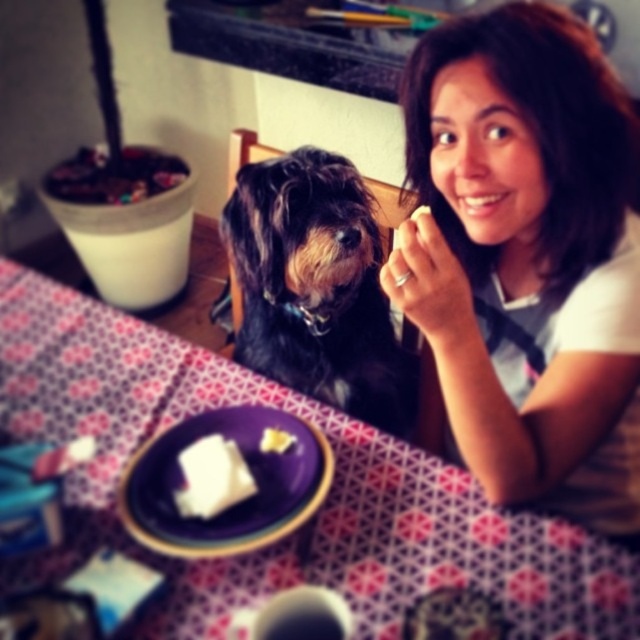
Question: Which of the following is the closest to the observer?

Choices:
 (A) patterned fabric tablecloth at center
 (B) purple matte plate at center

Answer: (A)

Question: Does white cotton shirt at upper right appear on the right side of purple matte plate at center?

Choices:
 (A) no
 (B) yes

Answer: (B)

Question: From the image, what is the correct spatial relationship of patterned fabric tablecloth at center in relation to white soft cheese at center?

Choices:
 (A) right
 (B) left

Answer: (B)

Question: Estimate the real-world distances between objects in this image. Which object is closer to the white crumbly bread at center?

Choices:
 (A) shiny black fur at center
 (B) white cotton shirt at upper right
 (C) purple matte plate at center

Answer: (C)

Question: Which is nearer to the white cotton shirt at upper right?

Choices:
 (A) patterned fabric tablecloth at center
 (B) purple matte plate at center

Answer: (A)

Question: Is the position of white cotton shirt at upper right less distant than that of white crumbly bread at center?

Choices:
 (A) no
 (B) yes

Answer: (B)